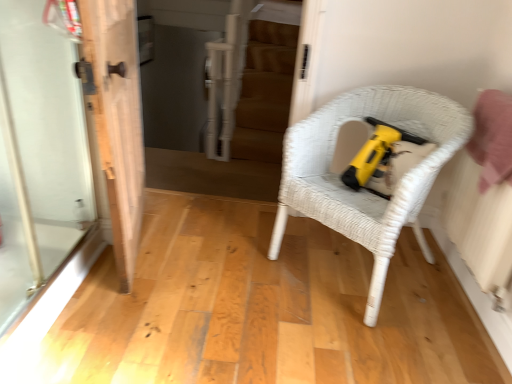
Identify the location of free region under white wicker chair at center (from a real-world perspective). This screenshot has width=512, height=384. (343, 269).